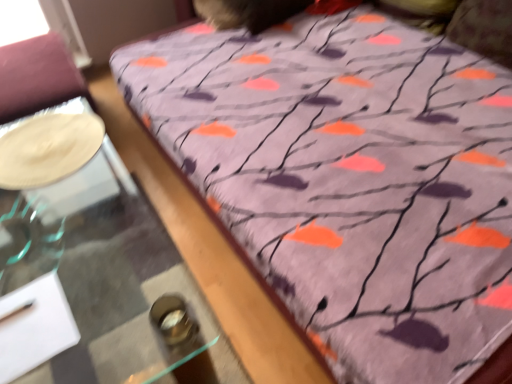
Describe the element at coordinates (125, 287) in the screenshot. I see `transparent glass table at lower left` at that location.

In order to face transparent glass table at lower left, should I rotate leftwards or rightwards?

Rotate left and turn 20.672 degrees.

This screenshot has height=384, width=512. What are the coordinates of `transparent glass table at lower left` in the screenshot? It's located at (125, 287).

What is the approximate width of white glossy plate at left?

16.13 inches.

This screenshot has height=384, width=512. Describe the element at coordinates (48, 149) in the screenshot. I see `white glossy plate at left` at that location.

Measure the distance between white glossy plate at left and camera.

white glossy plate at left is 4.13 feet from camera.

The image size is (512, 384). I want to click on white glossy plate at left, so click(48, 149).

At what (x,y) coordinates should I click in order to perform the action: click on transparent glass table at lower left. Please return your answer as a coordinate pair (x, y). The height and width of the screenshot is (384, 512). Looking at the image, I should click on (125, 287).

Considering the relative positions of white glossy plate at left and transparent glass table at lower left in the image provided, is white glossy plate at left to the left of transparent glass table at lower left from the viewer's perspective?

Yes, white glossy plate at left is to the left of transparent glass table at lower left.

Consider the image. Which object is further away from the camera taking this photo, white glossy plate at left or transparent glass table at lower left?

white glossy plate at left is behind.

Which point is more forward, (15, 140) or (146, 210)?

The point (15, 140) is closer.

From the image's perspective, is white glossy plate at left above or below transparent glass table at lower left?

Based on their image positions, white glossy plate at left is located above transparent glass table at lower left.

From a real-world perspective, between white glossy plate at left and transparent glass table at lower left, who is vertically lower?

In real-world perspective, transparent glass table at lower left is lower.

Considering the sizes of objects white glossy plate at left and transparent glass table at lower left in the image provided, who is wider, white glossy plate at left or transparent glass table at lower left?

Wider between the two is transparent glass table at lower left.

Which of these two, white glossy plate at left or transparent glass table at lower left, stands taller?

Standing taller between the two is transparent glass table at lower left.

Considering the sizes of objects white glossy plate at left and transparent glass table at lower left in the image provided, who is smaller, white glossy plate at left or transparent glass table at lower left?

white glossy plate at left.

Is white glossy plate at left inside the boundaries of transparent glass table at lower left, or outside?

white glossy plate at left is located beyond the bounds of transparent glass table at lower left.

Is white glossy plate at left beside transparent glass table at lower left?

No.

Is white glossy plate at left positioned with its back to transparent glass table at lower left?

white glossy plate at left is not turned away from transparent glass table at lower left.

Measure the distance between white glossy plate at left and transparent glass table at lower left.

white glossy plate at left is 42.17 centimeters away from transparent glass table at lower left.

Find the location of `glass plate behind the transparent glass table at lower left`. glass plate behind the transparent glass table at lower left is located at coordinates (48, 149).

Based on the photo, considering the positions of objects transparent glass table at lower left and white glossy plate at left in the image provided, who is more to the left, transparent glass table at lower left or white glossy plate at left?

Positioned to the left is white glossy plate at left.

Relative to white glossy plate at left, is transparent glass table at lower left in front or behind?

Visually, transparent glass table at lower left is located in front of white glossy plate at left.

Which is in front, point (117, 265) or point (37, 118)?

Positioned in front is point (37, 118).

From the image's perspective, between transparent glass table at lower left and white glossy plate at left, which one is located above?

From the image's view, white glossy plate at left is above.

From a real-world perspective, does transparent glass table at lower left sit lower than white glossy plate at left?

Yes, from a real-world perspective, transparent glass table at lower left is below white glossy plate at left.

Considering the sizes of transparent glass table at lower left and white glossy plate at left in the image, is transparent glass table at lower left wider or thinner than white glossy plate at left?

Considering their sizes, transparent glass table at lower left looks broader than white glossy plate at left.

Considering the relative sizes of transparent glass table at lower left and white glossy plate at left in the image provided, is transparent glass table at lower left shorter than white glossy plate at left?

In fact, transparent glass table at lower left may be taller than white glossy plate at left.

Between transparent glass table at lower left and white glossy plate at left, which one has larger size?

transparent glass table at lower left.

Do you think transparent glass table at lower left is within white glossy plate at left, or outside of it?

transparent glass table at lower left is located beyond the bounds of white glossy plate at left.

Is transparent glass table at lower left directly adjacent to white glossy plate at left?

No.

Is transparent glass table at lower left facing towards white glossy plate at left?

No.

Can you tell me how much transparent glass table at lower left and white glossy plate at left differ in facing direction?

transparent glass table at lower left and white glossy plate at left are facing 88 degrees away from each other.

Find the location of a particular element. table located underneath the white glossy plate at left (from a real-world perspective) is located at coordinates (125, 287).

You are a GUI agent. You are given a task and a screenshot of the screen. Output one action in this format:
    pyautogui.click(x=<x>, y=<y>)
    Task: Click on the table in front of the white glossy plate at left
    This screenshot has width=512, height=384.
    Given the screenshot: What is the action you would take?
    tap(125, 287)

I want to click on table located below the white glossy plate at left (from the image's perspective), so click(125, 287).